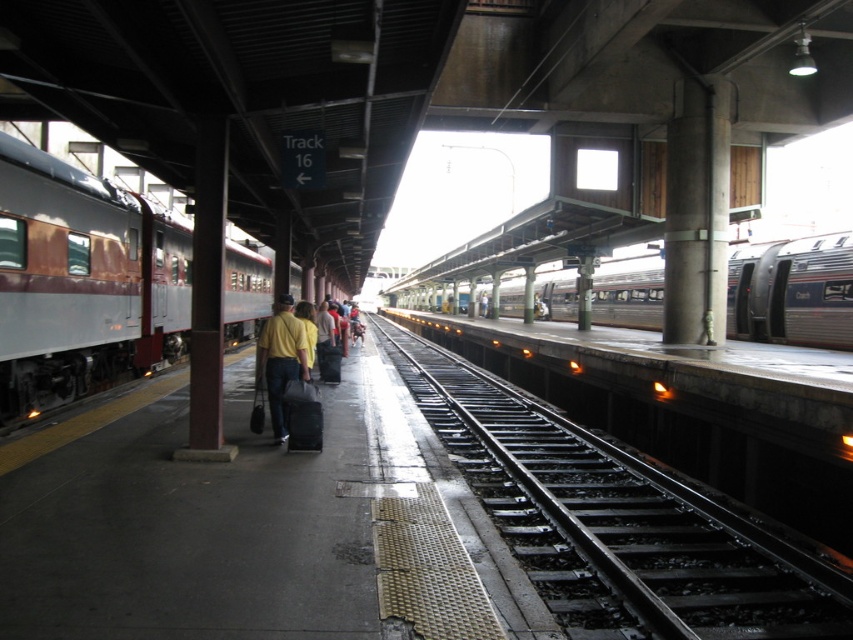
You are a passenger on the platform and want to walk from the yellow matte shirt at center to the silver metallic train at center. Is there enough space to walk directly between them without moving sideways?

The silver metallic train at center might be wider than yellow matte shirt at center, so there might not be enough space to walk directly between them without moving sideways.

You are a passenger on the platform and need to board the silver metallic train at center. Which direction should you walk to reach it from the rustic metal train at left?

The rustic metal train at left is in front of the silver metallic train at center, so you should walk towards the rear of the rustic metal train at left to reach the silver metallic train at center.

You are standing at the center of the platform and want to locate the rustic metal train at left. According to the coordinates provided, in which direction should you look to see it?

The rustic metal train at left is located at coordinates point (82, 282), which means it is positioned to the left side of the platform. Therefore, you should look towards the left direction to see it.